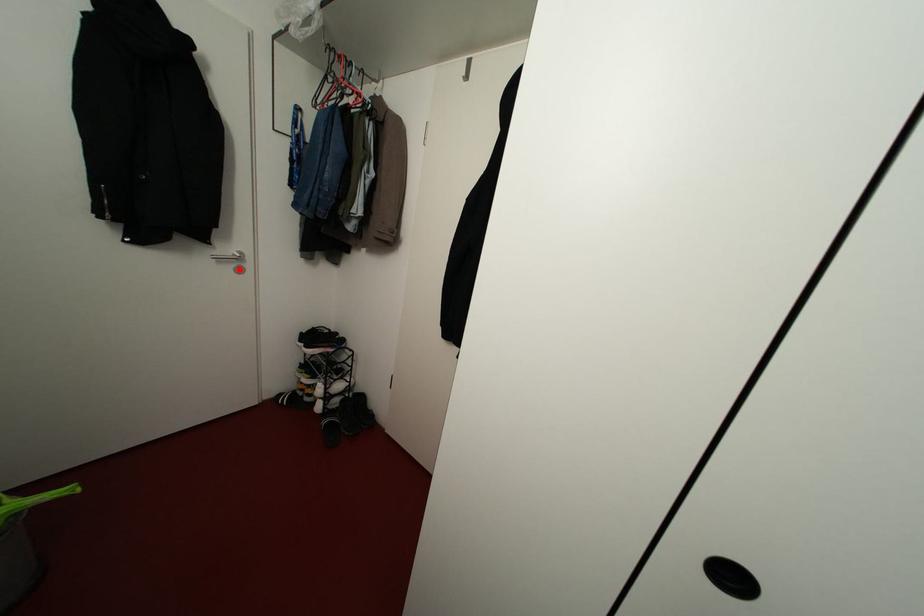
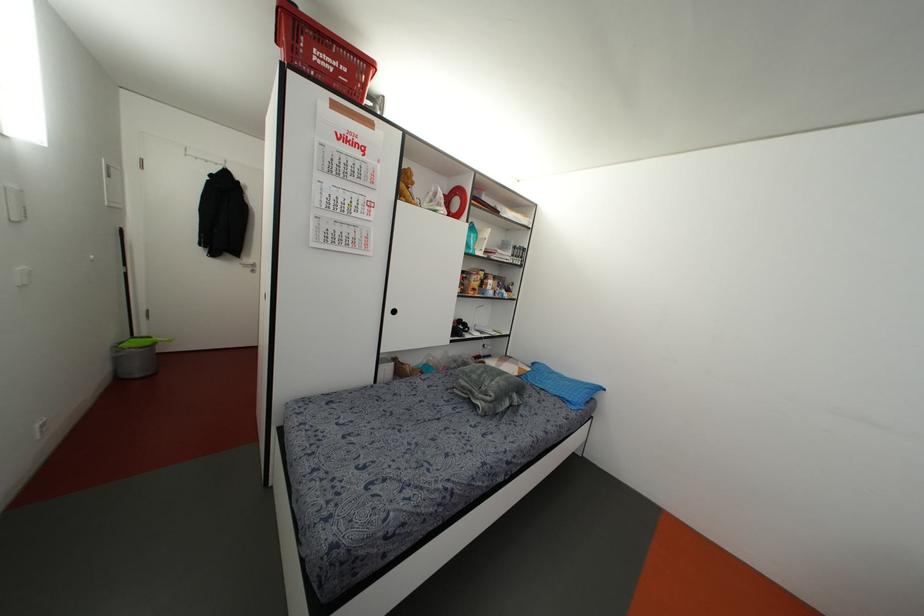
Where in the second image is the point corresponding to the highlighted location from the first image?

(252, 270)